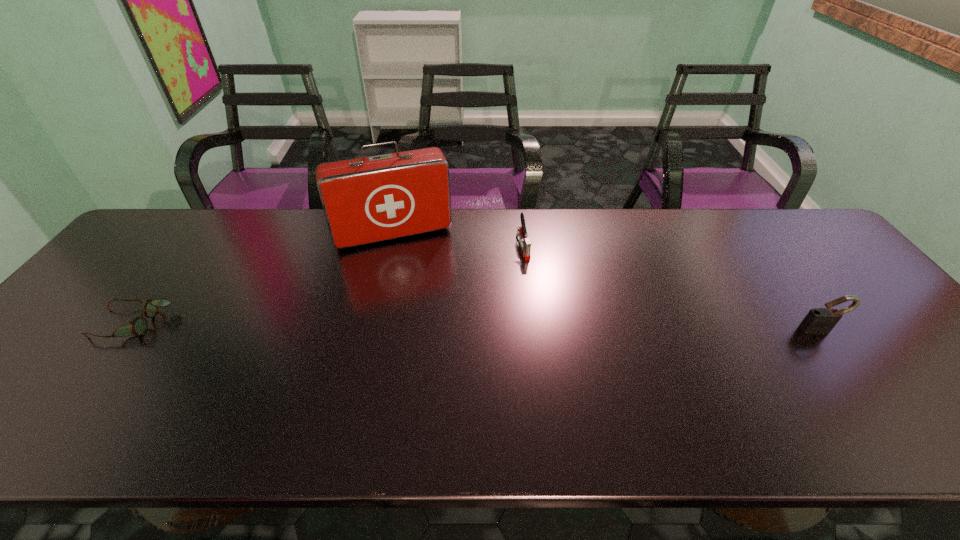
Identify the location of the leftmost object. (138, 326).

You are a GUI agent. You are given a task and a screenshot of the screen. Output one action in this format:
    pyautogui.click(x=<x>, y=<y>)
    Task: Click on the shortest object
    The width and height of the screenshot is (960, 540).
    Given the screenshot: What is the action you would take?
    pyautogui.click(x=138, y=326)

This screenshot has width=960, height=540. I want to click on padlock, so click(x=820, y=320).

Locate an element on the screen. The height and width of the screenshot is (540, 960). the rightmost object is located at coordinates (820, 320).

At what (x,y) coordinates should I click in order to perform the action: click on the third tallest object. Please return your answer as a coordinate pair (x, y). Image resolution: width=960 pixels, height=540 pixels. Looking at the image, I should click on (525, 243).

Locate an element on the screen. stapler is located at coordinates (525, 243).

This screenshot has height=540, width=960. I want to click on the third object from right to left, so (365, 200).

This screenshot has width=960, height=540. Identify the location of the first-aid kit. tap(365, 200).

Image resolution: width=960 pixels, height=540 pixels. I want to click on free space located 0.060m on the front-facing side of the spectacles, so click(x=74, y=323).

Where is `blank space located on the front-facing side of the spectacles`? This screenshot has width=960, height=540. blank space located on the front-facing side of the spectacles is located at coordinates (78, 323).